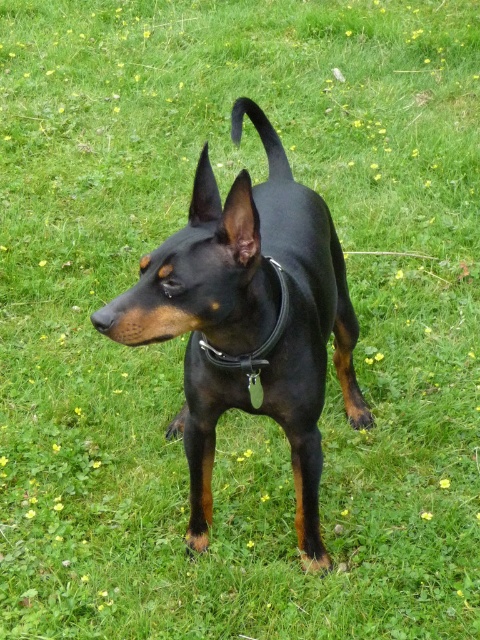
Question: Can you confirm if black smooth dog at center is bigger than black leather collar at center?

Choices:
 (A) yes
 (B) no

Answer: (A)

Question: Which point is closer to the camera taking this photo?

Choices:
 (A) (204, 432)
 (B) (288, 298)

Answer: (B)

Question: Among these points, which one is nearest to the camera?

Choices:
 (A) (253, 362)
 (B) (208, 403)

Answer: (A)

Question: Does black smooth dog at center have a larger size compared to black leather collar at center?

Choices:
 (A) yes
 (B) no

Answer: (A)

Question: Does black smooth dog at center have a smaller size compared to black leather collar at center?

Choices:
 (A) no
 (B) yes

Answer: (A)